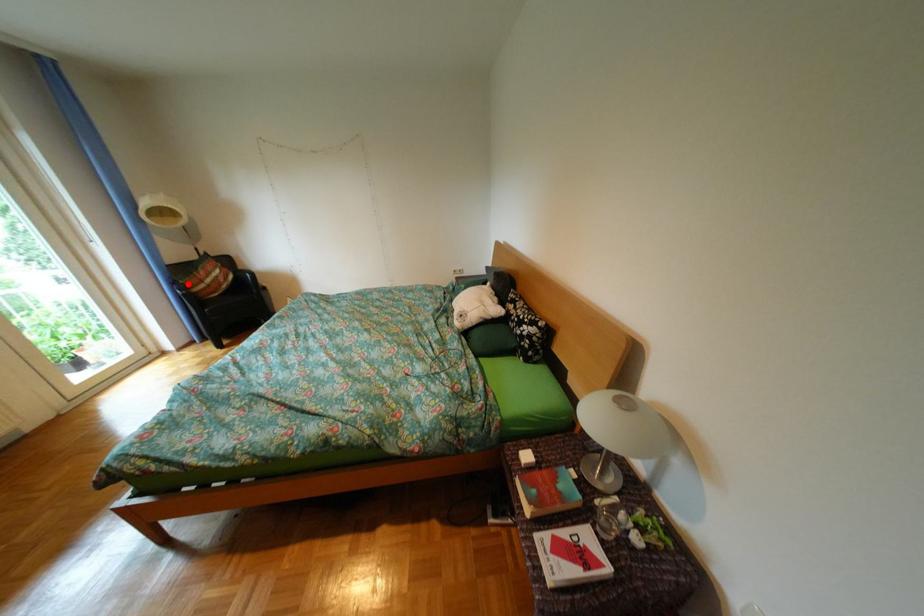
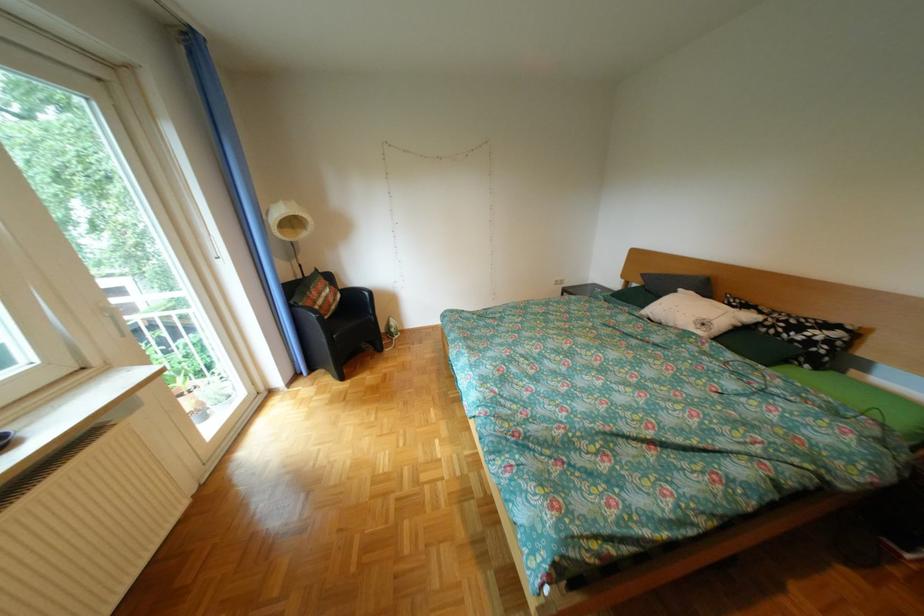
Question: I am providing you with two images of the same scene from different viewpoints. A red point is shown in image1. For the corresponding object point in image2, is it positioned nearer or farther from the camera?

Choices:
 (A) Nearer
 (B) Farther

Answer: (A)